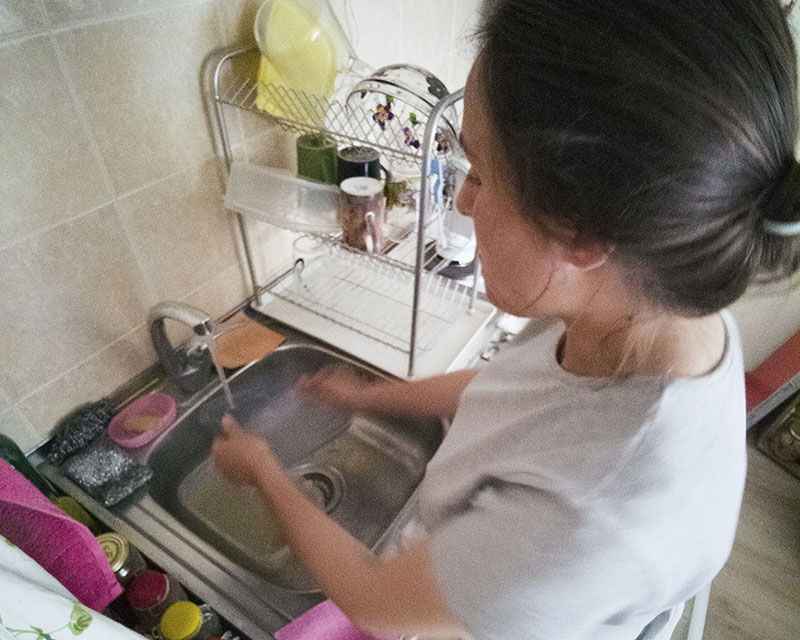
Image resolution: width=800 pixels, height=640 pixels. Find the location of `faucet`. faucet is located at coordinates (180, 312).